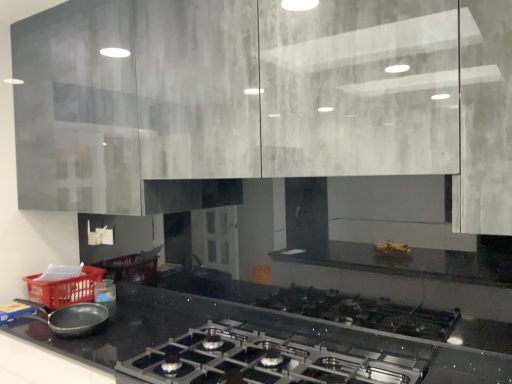
Where is `free space above red plastic basket at lower left (from a real-world perspective)`? Image resolution: width=512 pixels, height=384 pixels. free space above red plastic basket at lower left (from a real-world perspective) is located at coordinates pyautogui.click(x=64, y=271).